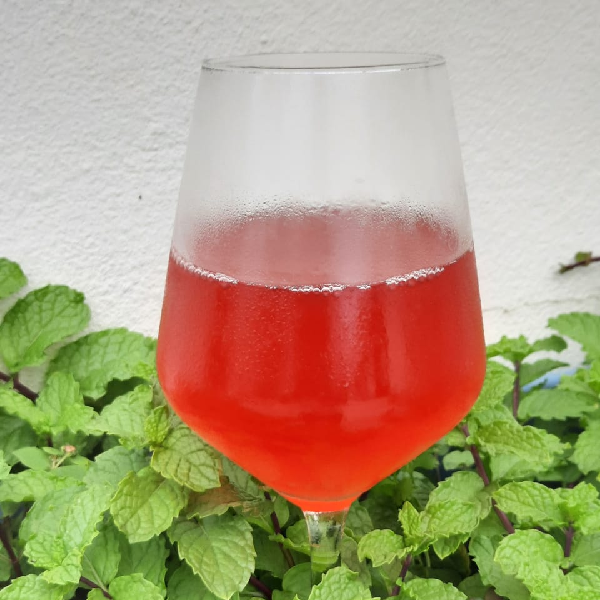
Locate an element on the screen. This screenshot has height=600, width=600. glass stem is located at coordinates (325, 537).